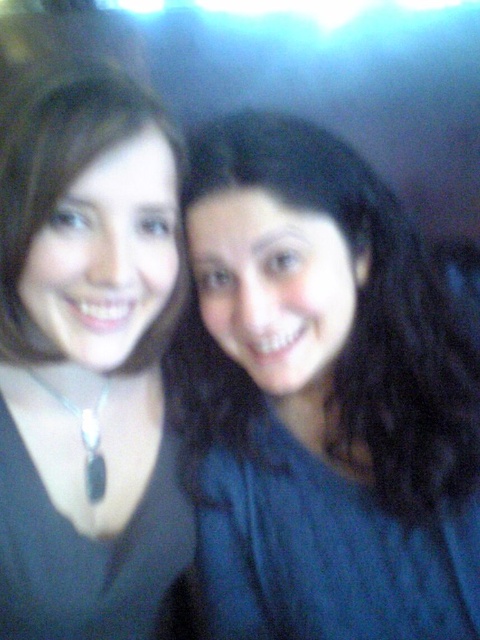
You are a photographer reviewing the image and notice two items at the center of the photo. The items are the black matte necklace at center and the dark blue knitted dress at center. Which of these two items is located to the left?

The black matte necklace at center is positioned on the left side of dark blue knitted dress at center, so the black matte necklace at center is located to the left.

You are holding a camera and want to take a selfie with a point at coordinate point (58, 93). If your arm can extend up to 24 inches, can you reach that point with your camera?

The point at coordinate point (58, 93) is 24.77 inches away from the camera, which is slightly beyond the 24 inches arm extension limit. Therefore, you cannot reach the point with your camera.

You are trying to identify the positions of the dark blue knitted dress at center and the black matte necklace at left in the selfie. Based on the scene description, can you determine which object is positioned to the right of the other?

The dark blue knitted dress at center is to the right of the black matte necklace at left, so the dress is positioned to the right of the necklace.